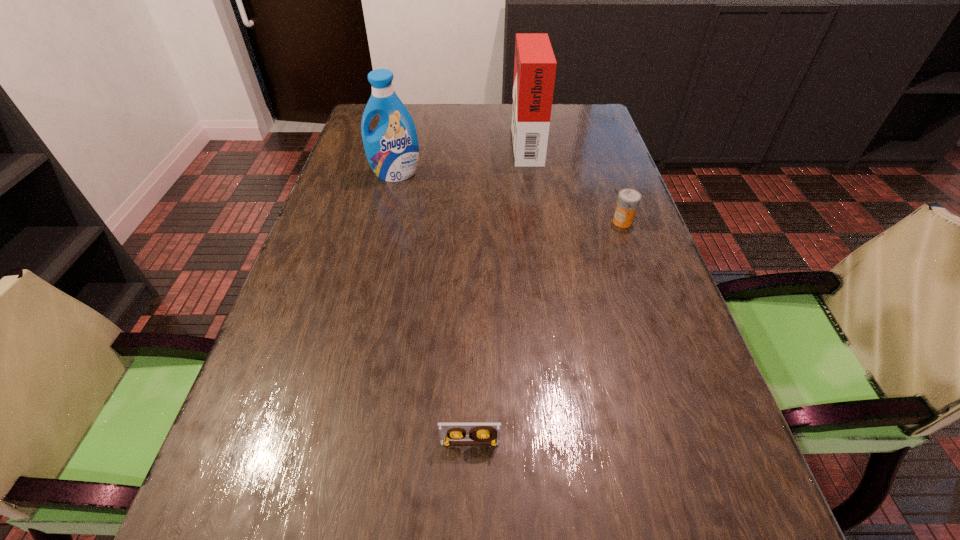
I want to click on vacant point located between the farthest object and the leftmost object, so click(x=461, y=158).

What are the coordinates of `unoccupied area between the third nearest object and the second object from left to right` in the screenshot? It's located at (433, 308).

Point out which object is positioned as the nearest to the videotape. Please provide its 2D coordinates. Your answer should be formatted as a tuple, i.e. [(x, y)], where the tuple contains the x and y coordinates of a point satisfying the conditions above.

[(628, 200)]

Identify which object is located as the nearest to the leftmost object. Please provide its 2D coordinates. Your answer should be formatted as a tuple, i.e. [(x, y)], where the tuple contains the x and y coordinates of a point satisfying the conditions above.

[(535, 65)]

Locate an element on the screen. The width and height of the screenshot is (960, 540). free region that satisfies the following two spatial constraints: 1. on the label side of the medicine; 2. at the front of the shortest object with visible reels is located at coordinates (701, 443).

Identify the location of free space that satisfies the following two spatial constraints: 1. on the front-facing side of the third object from left to right; 2. at the front of the shortest object with visible reels. Image resolution: width=960 pixels, height=540 pixels. (569, 443).

The width and height of the screenshot is (960, 540). I want to click on vacant space that satisfies the following two spatial constraints: 1. on the front-facing side of the farthest object; 2. at the front of the third object from right to left with visible reels, so click(569, 443).

I want to click on free space that satisfies the following two spatial constraints: 1. on the front-facing side of the farthest object; 2. on the front-facing side of the leftmost object, so click(x=531, y=174).